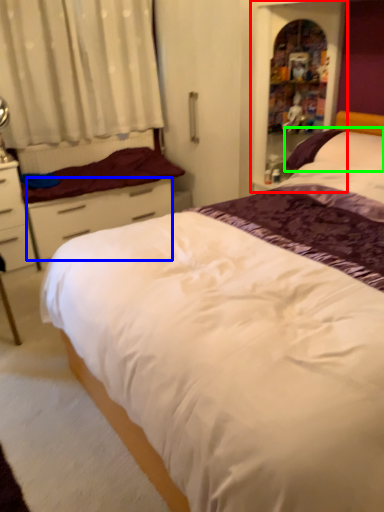
Question: Considering the real-world distances, which object is closest to bookshelf (highlighted by a red box)? drawer (highlighted by a blue box) or pillow (highlighted by a green box).

Choices:
 (A) drawer
 (B) pillow

Answer: (B)